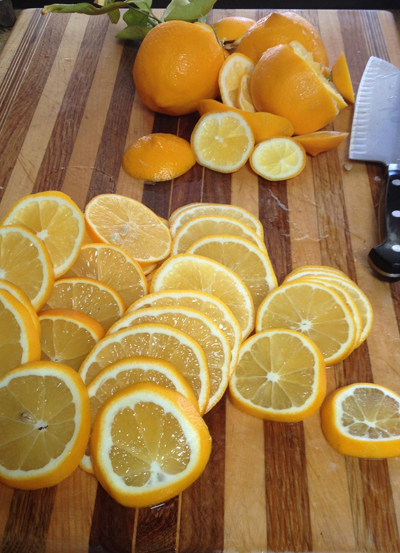
Identify the location of top edge of cutting board. (340, 10).